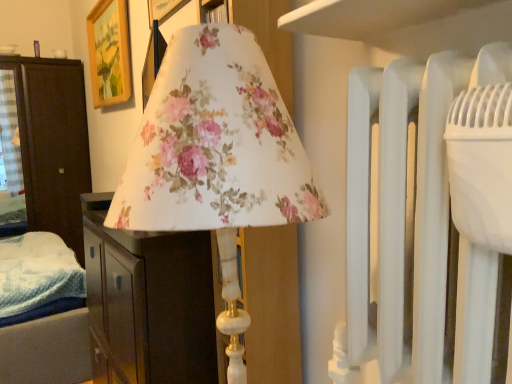
Find the location of a particular element. wooden picture frame at upper left is located at coordinates pos(109,53).

Describe the element at coordinates (53, 143) in the screenshot. I see `dark wood wardrobe at left, arranged as the second furniture when viewed from the front` at that location.

Find the location of a particular element. This screenshot has width=512, height=384. wooden picture frame at upper left is located at coordinates (109, 53).

Is floral fabric lampshade at center, placed as the second furniture when sorted from left to right, far from wooden picture frame at upper left?

Absolutely, floral fabric lampshade at center, placed as the second furniture when sorted from left to right, is distant from wooden picture frame at upper left.

From a real-world perspective, between floral fabric lampshade at center, placed as the second furniture when sorted from left to right, and wooden picture frame at upper left, who is vertically higher?

wooden picture frame at upper left is physically above.

Is floral fabric lampshade at center, positioned as the 1th furniture in right-to-left order, positioned beyond the bounds of wooden picture frame at upper left?

Yes, floral fabric lampshade at center, positioned as the 1th furniture in right-to-left order, is located beyond the bounds of wooden picture frame at upper left.

At what (x,y) coordinates should I click in order to perform the action: click on picture frame that appears above the floral fabric lampshade at center, the 1th furniture in the front-to-back sequence (from a real-world perspective). Please return your answer as a coordinate pair (x, y). Image resolution: width=512 pixels, height=384 pixels. Looking at the image, I should click on (109, 53).

Is wooden picture frame at upper left further to the viewer compared to floral fabric lampshade at center, placed as the second furniture when sorted from left to right?

Yes, it is.

Is wooden picture frame at upper left far from floral fabric lampshade at center, placed as the second furniture when sorted from left to right?

Indeed, wooden picture frame at upper left is not near floral fabric lampshade at center, placed as the second furniture when sorted from left to right.

Does wooden picture frame at upper left have a larger size compared to floral fabric lampshade at center, positioned as the 1th furniture in right-to-left order?

Incorrect, wooden picture frame at upper left is not larger than floral fabric lampshade at center, positioned as the 1th furniture in right-to-left order.

The height and width of the screenshot is (384, 512). I want to click on picture frame above the floral fabric lampshade at center, which is the second furniture from back to front (from a real-world perspective), so pos(109,53).

From the image's perspective, which one is positioned higher, dark wood wardrobe at left, the first furniture positioned from the left, or floral fabric lampshade at center, placed as the second furniture when sorted from left to right?

From the image's view, dark wood wardrobe at left, the first furniture positioned from the left, is above.

Is dark wood wardrobe at left, the first furniture positioned from the left, turned away from floral fabric lampshade at center, placed as the second furniture when sorted from left to right?

dark wood wardrobe at left, the first furniture positioned from the left, does not have its back to floral fabric lampshade at center, placed as the second furniture when sorted from left to right.

Looking at this image, considering the relative positions of dark wood wardrobe at left, placed as the first furniture when sorted from back to front, and floral fabric lampshade at center, positioned as the 1th furniture in right-to-left order, in the image provided, is dark wood wardrobe at left, placed as the first furniture when sorted from back to front, behind floral fabric lampshade at center, positioned as the 1th furniture in right-to-left order,?

Yes, dark wood wardrobe at left, placed as the first furniture when sorted from back to front, is behind floral fabric lampshade at center, positioned as the 1th furniture in right-to-left order.

Based on the photo, considering the relative sizes of dark wood wardrobe at left, placed as the first furniture when sorted from back to front, and floral fabric lampshade at center, positioned as the 1th furniture in right-to-left order, in the image provided, is dark wood wardrobe at left, placed as the first furniture when sorted from back to front, taller than floral fabric lampshade at center, positioned as the 1th furniture in right-to-left order,?

Yes.

I want to click on furniture on the left of wooden picture frame at upper left, so click(53, 143).

Does wooden picture frame at upper left have a lesser width compared to dark wood wardrobe at left, arranged as the second furniture when viewed from the front?

Indeed, wooden picture frame at upper left has a lesser width compared to dark wood wardrobe at left, arranged as the second furniture when viewed from the front.

Is wooden picture frame at upper left far away from dark wood wardrobe at left, placed as the first furniture when sorted from back to front?

No.

Is wooden picture frame at upper left spatially inside dark wood wardrobe at left, placed as the first furniture when sorted from back to front, or outside of it?

wooden picture frame at upper left cannot be found inside dark wood wardrobe at left, placed as the first furniture when sorted from back to front.

Between point (36, 95) and point (123, 83), which one is positioned behind?

Positioned behind is point (36, 95).

From the image's perspective, who appears lower, dark wood wardrobe at left, which is counted as the 2th furniture, starting from the right, or wooden picture frame at upper left?

dark wood wardrobe at left, which is counted as the 2th furniture, starting from the right.

Locate an element on the screen. The width and height of the screenshot is (512, 384). the 1st furniture located beneath the wooden picture frame at upper left (from a real-world perspective) is located at coordinates (53, 143).

Considering the sizes of objects dark wood wardrobe at left, arranged as the second furniture when viewed from the front, and wooden picture frame at upper left in the image provided, who is smaller, dark wood wardrobe at left, arranged as the second furniture when viewed from the front, or wooden picture frame at upper left?

wooden picture frame at upper left.

From the image's perspective, which one is positioned higher, floral fabric lampshade at center, placed as the second furniture when sorted from left to right, or dark wood wardrobe at left, which is counted as the 2th furniture, starting from the right?

dark wood wardrobe at left, which is counted as the 2th furniture, starting from the right.

From a real-world perspective, is floral fabric lampshade at center, the 1th furniture in the front-to-back sequence, beneath dark wood wardrobe at left, the first furniture positioned from the left?

Yes.

Is dark wood wardrobe at left, which is counted as the 2th furniture, starting from the right, inside floral fabric lampshade at center, which is the second furniture from back to front?

No, dark wood wardrobe at left, which is counted as the 2th furniture, starting from the right, is not a part of floral fabric lampshade at center, which is the second furniture from back to front.

Would you consider floral fabric lampshade at center, which is the second furniture from back to front, to be distant from dark wood wardrobe at left, placed as the first furniture when sorted from back to front?

floral fabric lampshade at center, which is the second furniture from back to front, is far away from dark wood wardrobe at left, placed as the first furniture when sorted from back to front.

From a real-world perspective, which furniture is the 2nd one underneath the wooden picture frame at upper left? Please provide its 2D coordinates.

[(149, 302)]

The width and height of the screenshot is (512, 384). What are the coordinates of `picture frame that is above the floral fabric lampshade at center, which is the second furniture from back to front (from a real-world perspective)` in the screenshot? It's located at (109, 53).

When comparing their distances from floral fabric lampshade at center, positioned as the 1th furniture in right-to-left order, does dark wood wardrobe at left, arranged as the second furniture when viewed from the front, or wooden picture frame at upper left seem closer?

wooden picture frame at upper left is positioned closer to the anchor floral fabric lampshade at center, positioned as the 1th furniture in right-to-left order.

Based on their spatial positions, is floral fabric lampshade at center, placed as the second furniture when sorted from left to right, or wooden picture frame at upper left further from dark wood wardrobe at left, which is counted as the 2th furniture, starting from the right?

The object further to dark wood wardrobe at left, which is counted as the 2th furniture, starting from the right, is floral fabric lampshade at center, placed as the second furniture when sorted from left to right.

Which object lies nearer to the anchor point wooden picture frame at upper left, floral fabric lampshade at center, placed as the second furniture when sorted from left to right, or dark wood wardrobe at left, the first furniture positioned from the left?

dark wood wardrobe at left, the first furniture positioned from the left.

Estimate the real-world distances between objects in this image. Which object is closer to floral fabric lampshade at center, positioned as the 1th furniture in right-to-left order, wooden picture frame at upper left or dark wood wardrobe at left, arranged as the second furniture when viewed from the front?

wooden picture frame at upper left.

When comparing their distances from dark wood wardrobe at left, which is counted as the 2th furniture, starting from the right, does wooden picture frame at upper left or floral fabric lampshade at center, the 1th furniture in the front-to-back sequence, seem further?

The object further to dark wood wardrobe at left, which is counted as the 2th furniture, starting from the right, is floral fabric lampshade at center, the 1th furniture in the front-to-back sequence.

Which object lies further to the anchor point wooden picture frame at upper left, dark wood wardrobe at left, which is counted as the 2th furniture, starting from the right, or floral fabric lampshade at center, the 1th furniture in the front-to-back sequence?

floral fabric lampshade at center, the 1th furniture in the front-to-back sequence, is further to wooden picture frame at upper left.

Identify the location of picture frame located between floral fabric lampshade at center, positioned as the 1th furniture in right-to-left order, and dark wood wardrobe at left, which is counted as the 2th furniture, starting from the right, in the depth direction. (109, 53).